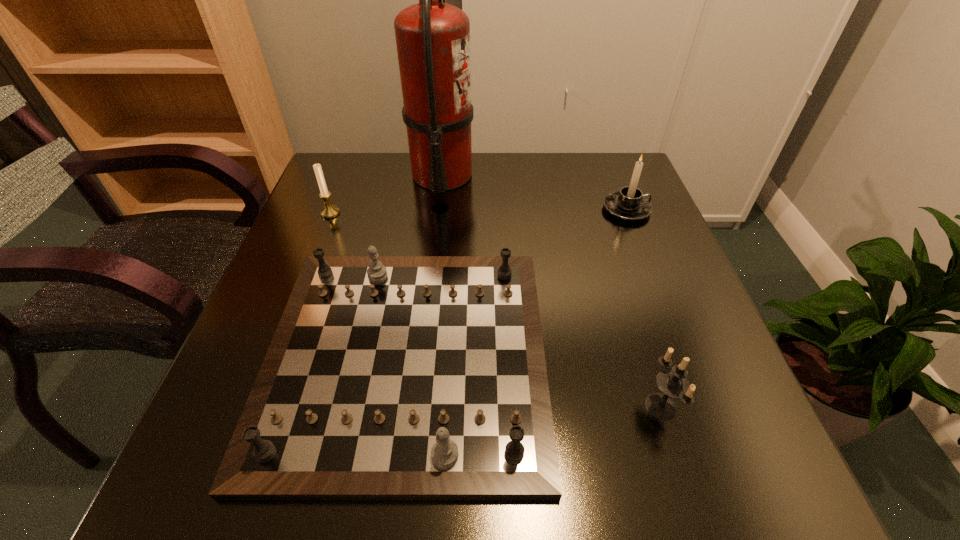
The image size is (960, 540). I want to click on free space between the fire extinguisher and the leftmost candle holder, so click(386, 194).

Locate which object ranks second in proximity to the shortest object. Please provide its 2D coordinates. Your answer should be formatted as a tuple, i.e. [(x, y)], where the tuple contains the x and y coordinates of a point satisfying the conditions above.

[(328, 211)]

Find the location of a particular element. The height and width of the screenshot is (540, 960). the fourth closest object relative to the shortest object is located at coordinates (630, 204).

Locate which candle holder ranks in proximity to the leftmost candle holder. Please provide its 2D coordinates. Your answer should be formatted as a tuple, i.e. [(x, y)], where the tuple contains the x and y coordinates of a point satisfying the conditions above.

[(630, 204)]

The height and width of the screenshot is (540, 960). What are the coordinates of `candle holder that is the second closest to the shortest object` in the screenshot? It's located at (328, 211).

I want to click on vacant space that satisfies the following two spatial constraints: 1. toward the nozzle of the tallest object; 2. on the board of the shortest object, so click(422, 356).

The width and height of the screenshot is (960, 540). In order to click on vacant space that satisfies the following two spatial constraints: 1. toward the nozzle of the fire extinguisher; 2. on the back side of the nearest candle holder in this screenshot , I will do `click(417, 407)`.